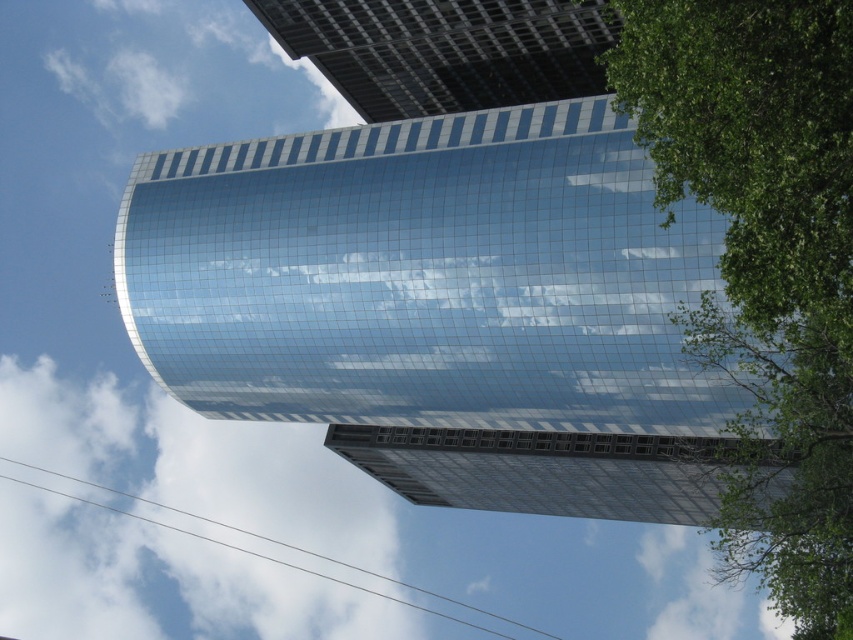
You are standing at the center of the image and want to locate the glossy glass tower at center. According to the coordinates, where exactly is it positioned?

The glossy glass tower at center is positioned at coordinates point (442, 307).

You are an architect designing a new park near the glossy glass tower at center and the white fluffy cloud at upper left. The park must have a walking path between them. What is the minimum length of the path in feet?

The glossy glass tower at center and the white fluffy cloud at upper left are 571.77 feet apart, so the minimum length of the path between them should be at least 571.77 feet to ensure it reaches both points.

You are an architect analyzing the image of a modern cityscape. You see the glossy glass tower at center and the green leafy tree at right. Based on their positions, which one is higher in the image?

The glossy glass tower at center is located above the green leafy tree at right, so it is higher in the image.